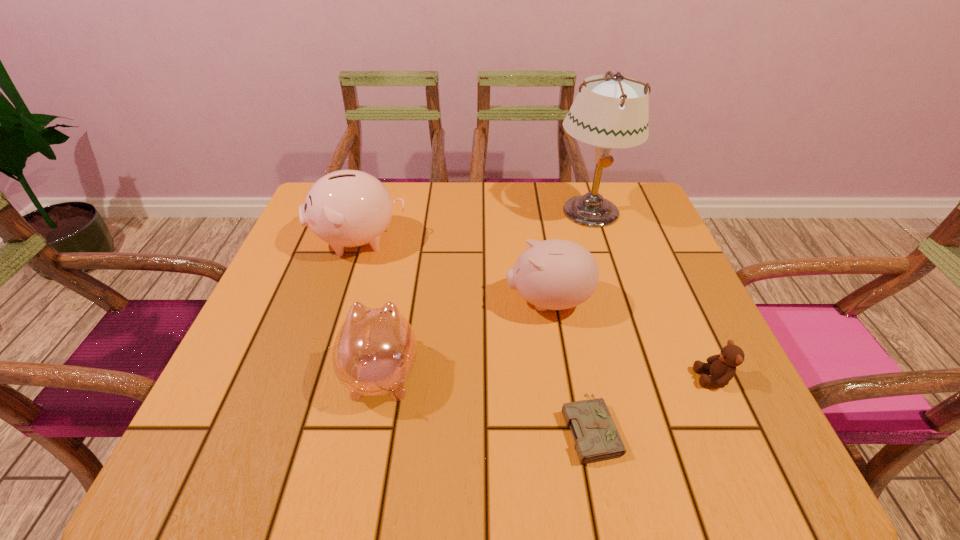
Locate an element on the screen. This screenshot has width=960, height=540. the tallest object is located at coordinates (614, 114).

I want to click on the second tallest object, so click(347, 208).

Locate an element on the screen. The height and width of the screenshot is (540, 960). the farthest piggy bank is located at coordinates (347, 208).

The height and width of the screenshot is (540, 960). I want to click on the third farthest object, so click(x=555, y=274).

Where is `the rightmost piggy bank`? the rightmost piggy bank is located at coordinates (555, 274).

In order to click on the nearest piggy bank in this screenshot , I will do `click(374, 352)`.

Identify the location of the second shortest object. (722, 367).

Where is `the shortest object`? The height and width of the screenshot is (540, 960). the shortest object is located at coordinates (596, 437).

This screenshot has width=960, height=540. I want to click on vacant space located 0.310m on the lampshade of the tallest object, so click(x=626, y=328).

This screenshot has height=540, width=960. I want to click on blank space located 0.090m on the back of the tallest piggy bank, so click(x=372, y=199).